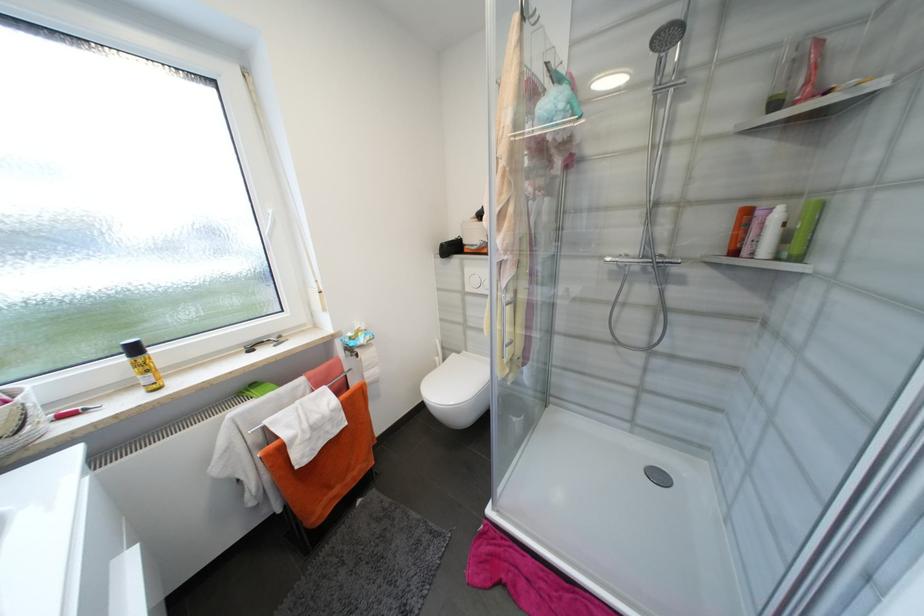
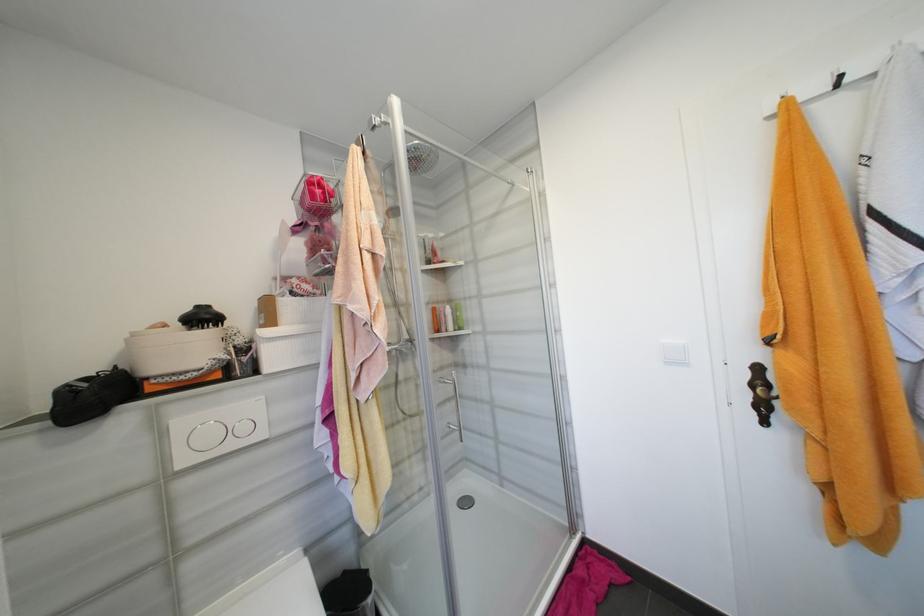
Question: How did the camera likely rotate?

Choices:
 (A) Left
 (B) Right
 (C) Up
 (D) Down

Answer: (B)